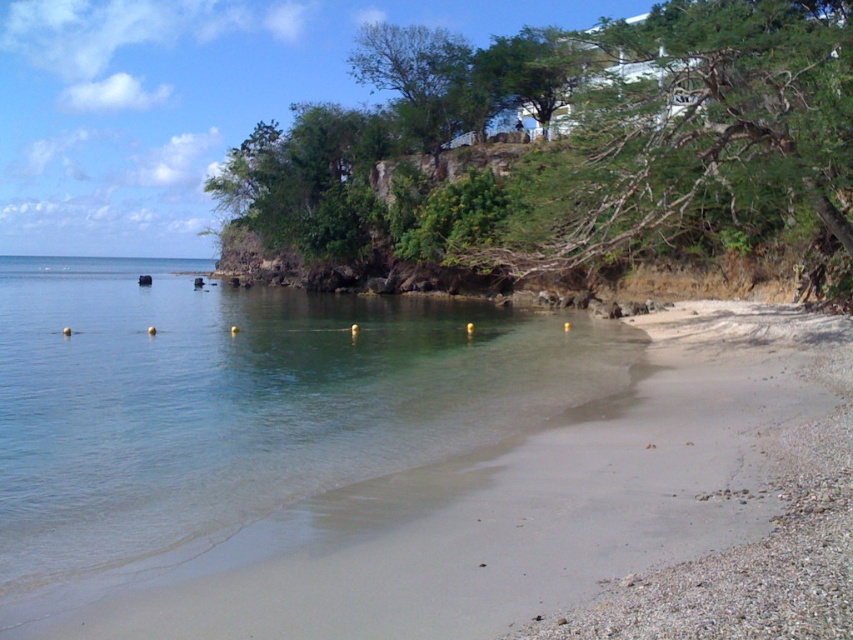
You are standing on the beach and want to take a photo of the clear water at lower left and the green leafy tree at upper center. Which object will appear closer to the bottom of your camera viewfinder?

The clear water at lower left will appear closer to the bottom of your camera viewfinder because it is positioned lower than the green leafy tree at upper center.

You are standing on the beach and want to walk towards the green leafy tree at upper center. Which direction should you move to avoid the clear water at lower left?

To avoid the clear water at lower left, you should move towards the right side of the beach since the clear water at lower left is narrower than the green leafy tree at upper center, which is wider. This means the tree area extends further to the right, providing a path away from the water.

You are a swimmer planning to enter the water near the clear water at lower left. From your position at the beach, which direction should you look to see the green leafy tree at upper center?

The green leafy tree at upper center is above the clear water at lower left, so you should look upward from the clear water at lower left to see the green leafy tree at upper center.